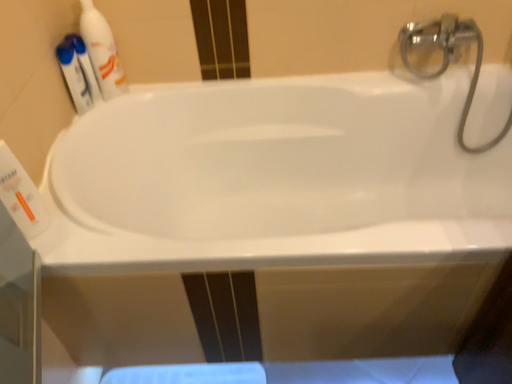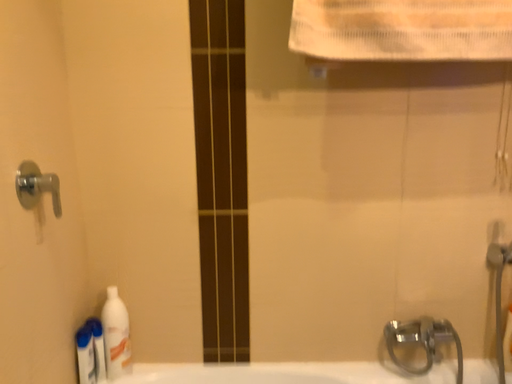
Question: Which way did the camera rotate in the video?

Choices:
 (A) rotated downward
 (B) rotated upward

Answer: (B)